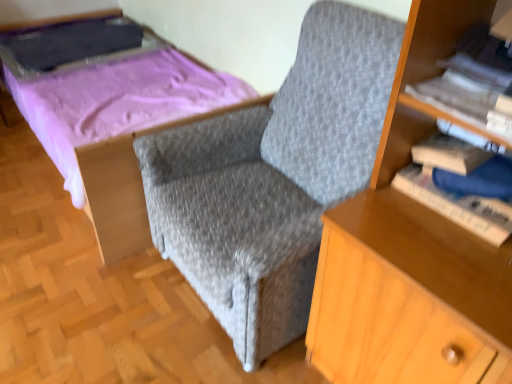
Question: Is matte purple bed at upper left further to the viewer compared to white paper book at upper right, the first book when ordered from top to bottom?

Choices:
 (A) no
 (B) yes

Answer: (B)

Question: Is matte purple bed at upper left at the left side of white paper book at upper right, placed as the 2th book when sorted from bottom to top?

Choices:
 (A) yes
 (B) no

Answer: (A)

Question: From the image's perspective, is matte purple bed at upper left below white paper book at upper right, placed as the 2th book when sorted from bottom to top?

Choices:
 (A) yes
 (B) no

Answer: (B)

Question: Is white paper book at upper right, placed as the 2th book when sorted from bottom to top, inside matte purple bed at upper left?

Choices:
 (A) no
 (B) yes

Answer: (A)

Question: Is the position of matte purple bed at upper left less distant than that of white paper book at upper right, placed as the 2th book when sorted from bottom to top?

Choices:
 (A) yes
 (B) no

Answer: (B)

Question: In terms of size, does hardcover book at right, which ranks as the first book in bottom-to-top order, appear bigger or smaller than gray fabric armchair at center?

Choices:
 (A) big
 (B) small

Answer: (B)

Question: Choose the correct answer: Is hardcover book at right, which ranks as the 2th book in top-to-bottom order, inside gray fabric armchair at center or outside it?

Choices:
 (A) outside
 (B) inside

Answer: (A)

Question: Does point (480, 203) appear closer or farther from the camera than point (338, 21)?

Choices:
 (A) farther
 (B) closer

Answer: (B)

Question: From a real-world perspective, is hardcover book at right, which ranks as the 2th book in top-to-bottom order, above or below gray fabric armchair at center?

Choices:
 (A) above
 (B) below

Answer: (A)

Question: Is matte purple bed at upper left spatially inside gray fabric armchair at center, or outside of it?

Choices:
 (A) outside
 (B) inside

Answer: (A)

Question: From the image's perspective, relative to gray fabric armchair at center, is matte purple bed at upper left above or below?

Choices:
 (A) above
 (B) below

Answer: (A)

Question: Considering the relative positions of matte purple bed at upper left and gray fabric armchair at center in the image provided, is matte purple bed at upper left to the left or to the right of gray fabric armchair at center?

Choices:
 (A) left
 (B) right

Answer: (A)

Question: In the image, is matte purple bed at upper left positioned in front of or behind gray fabric armchair at center?

Choices:
 (A) front
 (B) behind

Answer: (B)

Question: In terms of width, does matte purple bed at upper left look wider or thinner when compared to white paper book at upper right, placed as the 2th book when sorted from bottom to top?

Choices:
 (A) wide
 (B) thin

Answer: (A)

Question: From the image's perspective, is matte purple bed at upper left above or below white paper book at upper right, placed as the 2th book when sorted from bottom to top?

Choices:
 (A) below
 (B) above

Answer: (B)